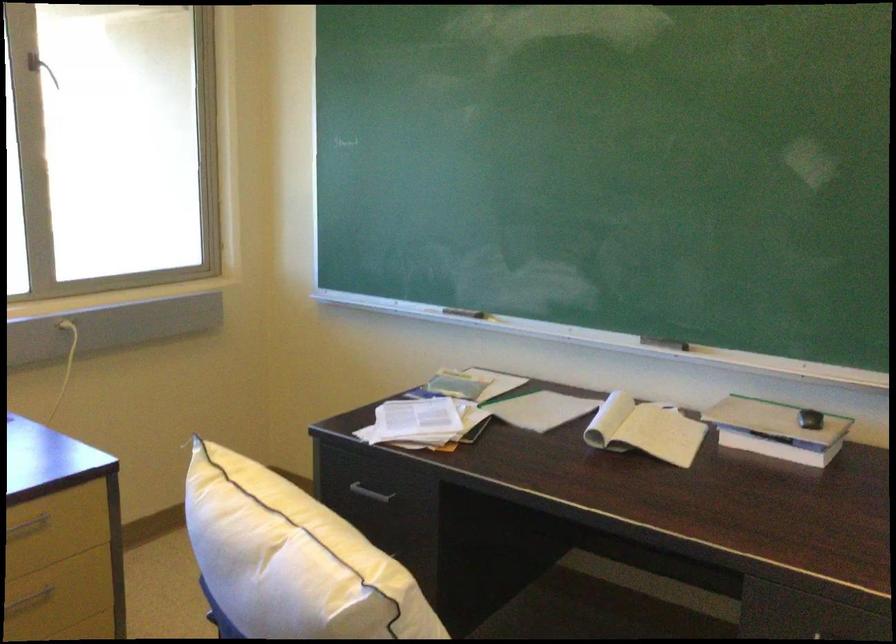
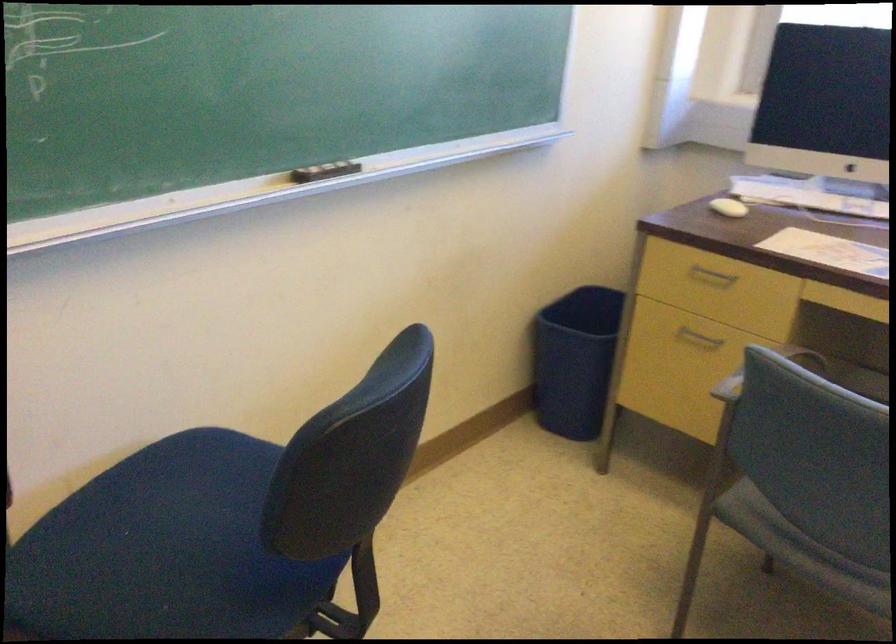
The first image is from the beginning of the video and the second image is from the end. How did the camera likely rotate when shooting the video?

The camera rotated toward left-down.